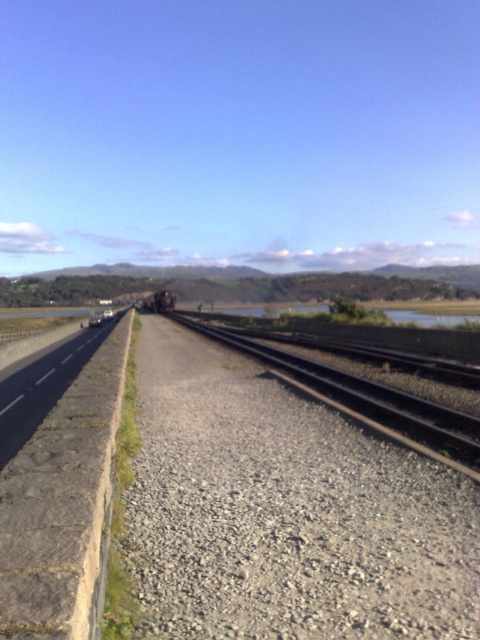
You are a delivery truck driver who needs to cross from the gray concrete highway at left to the railway track. The safety regulations state that the minimum distance between the truck and any obstacles must be at least 2 meters. Can you safely make this crossing?

The distance between the gray concrete highway at left and the viewer is 1.98 meters, which is less than the required 2 meters for safety. Therefore, you cannot safely cross to the railway track.

You are a photographer planning to capture a wide shot of the coastal landscape. You want to include both the gray concrete highway at left and the metal train track at center in your frame. Which of these two objects will appear smaller in your photograph?

The gray concrete highway at left will appear smaller in the photograph because it is described as being smaller than the metal train track at center.

You are standing at the point marked by the coordinates [368,403]. Looking around, you see the metal train track at center. Which direction should you walk to reach the paved road bordered by a low stone wall?

Walk towards the left from the point marked by the coordinates [368,403] to reach the paved road bordered by a low stone wall, as the road is to the left of the railway track.